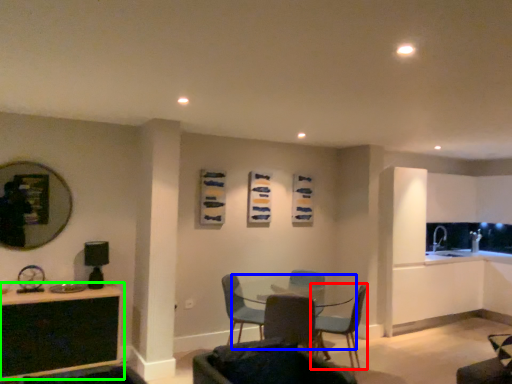
Question: Considering the real-world distances, which object is farthest from chair (highlighted by a red box)? round table (highlighted by a blue box) or table (highlighted by a green box)?

Choices:
 (A) round table
 (B) table

Answer: (B)